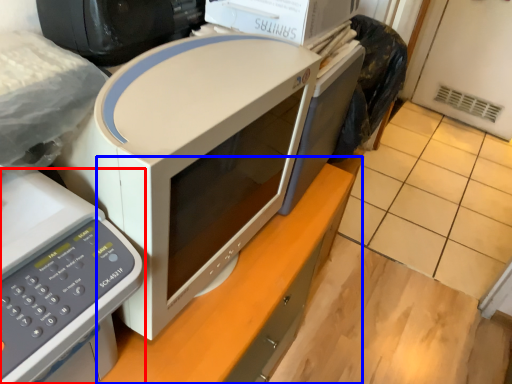
Question: Which point is further to the camera, home appliance (highlighted by a red box) or computer desk (highlighted by a blue box)?

Choices:
 (A) home appliance
 (B) computer desk

Answer: (B)